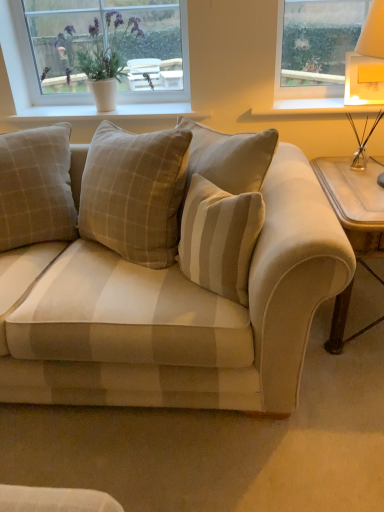
Image resolution: width=384 pixels, height=512 pixels. Find the location of `vacant region above white painted wood at upper right (from a real-world perspective)`. vacant region above white painted wood at upper right (from a real-world perspective) is located at coordinates (313, 104).